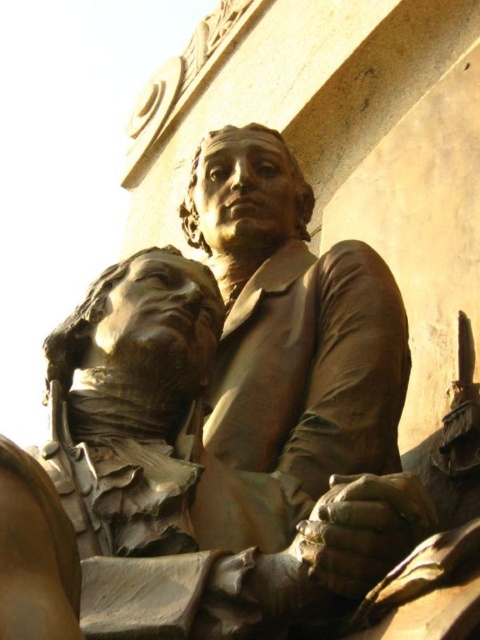
Based on the photo, does bronze statue at center come in front of bronze bust at center?

No.

Locate an element on the screen. This screenshot has height=640, width=480. bronze statue at center is located at coordinates (292, 321).

Image resolution: width=480 pixels, height=640 pixels. I want to click on bronze statue at center, so (x=292, y=321).